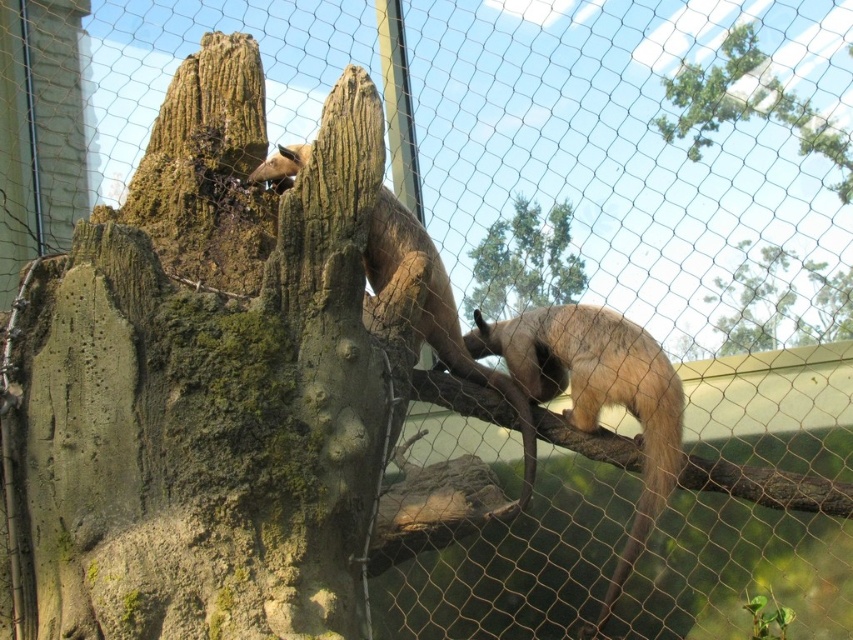
Question: Is green mossy tree trunk at upper center bigger than green mossy tree trunk at center?

Choices:
 (A) yes
 (B) no

Answer: (A)

Question: Which point appears closest to the camera in this image?

Choices:
 (A) (718, 337)
 (B) (531, 452)

Answer: (B)

Question: Does green mossy bark at upper left have a greater width compared to green mossy tree trunk at center?

Choices:
 (A) yes
 (B) no

Answer: (A)

Question: Estimate the real-world distances between objects in this image. Which object is farther from the green mossy bark at upper left?

Choices:
 (A) light brown fur anteater at upper left
 (B) green mossy tree trunk at upper right
 (C) fuzzy brown anteater at center

Answer: (B)

Question: Observing the image, what is the correct spatial positioning of light brown fur anteater at upper left in reference to green mossy tree trunk at center?

Choices:
 (A) above
 (B) below

Answer: (B)

Question: Which is farther from the green mossy tree trunk at upper center?

Choices:
 (A) green mossy tree trunk at center
 (B) green mossy tree trunk at upper right
 (C) green mossy bark at upper left
 (D) light brown fur anteater at upper left

Answer: (C)